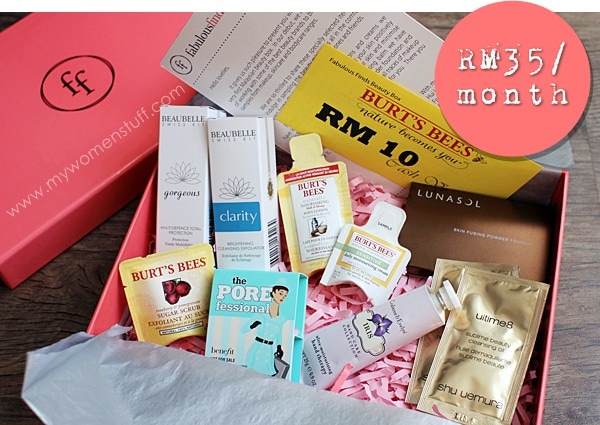
Locate an element on the screen. This screenshot has height=425, width=600. box is located at coordinates click(x=147, y=233).